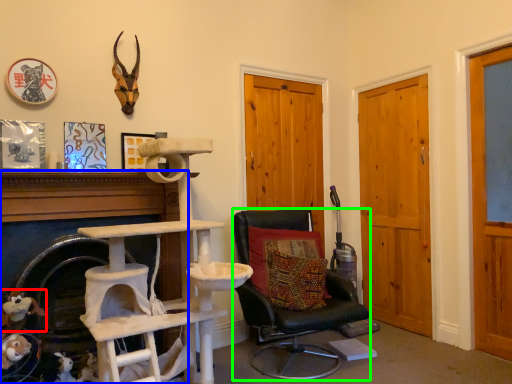
Question: Estimate the real-world distances between objects in this image. Which object is closer to toy (highlighted by a red box), fireplace (highlighted by a blue box) or chair (highlighted by a green box)?

Choices:
 (A) fireplace
 (B) chair

Answer: (A)